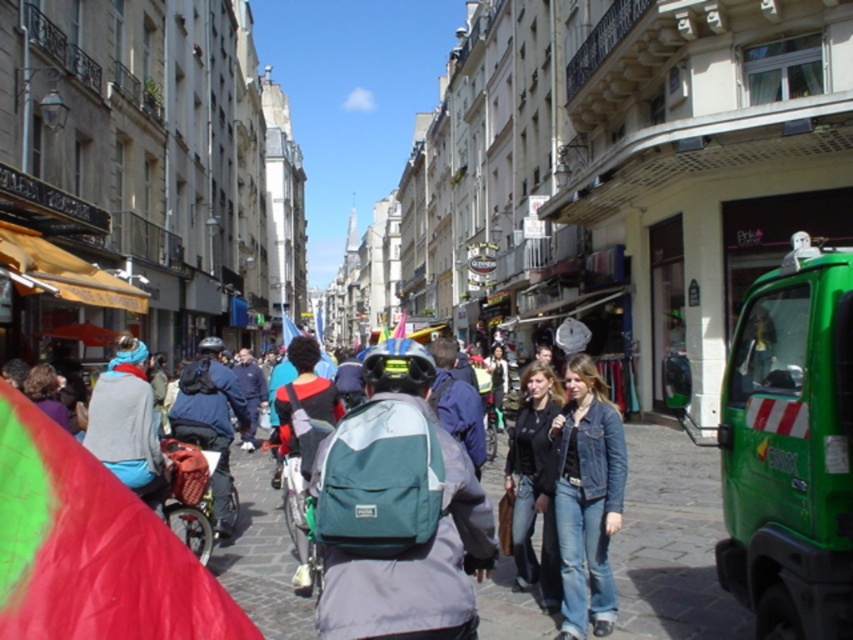
Question: Is green matte truck at right closer to the viewer compared to denim jacket at lower right?

Choices:
 (A) yes
 (B) no

Answer: (B)

Question: Does green matte truck at right lie in front of denim jacket at lower right?

Choices:
 (A) no
 (B) yes

Answer: (A)

Question: Which of these objects is positioned farthest from the jeans at center?

Choices:
 (A) green matte truck at right
 (B) denim jacket at lower right
 (C) denim jacket at center

Answer: (C)

Question: Which point is closer to the camera?

Choices:
 (A) (251, 500)
 (B) (813, 243)
 (C) (585, 586)

Answer: (C)

Question: Is the position of green matte truck at right more distant than that of jeans at center?

Choices:
 (A) yes
 (B) no

Answer: (A)

Question: Which object is closer to the camera taking this photo?

Choices:
 (A) green matte truck at right
 (B) denim jacket at lower right

Answer: (B)